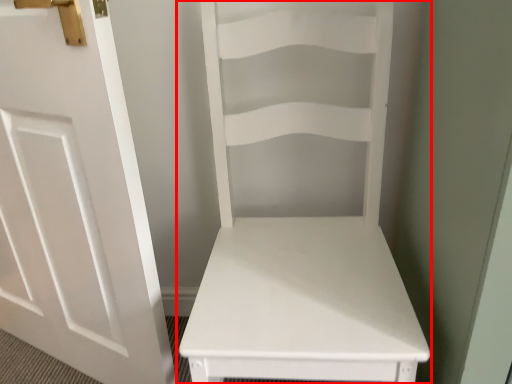
Question: From the image's perspective, what is the correct spatial positioning of furniture (annotated by the red box) in reference to door?

Choices:
 (A) below
 (B) above

Answer: (A)